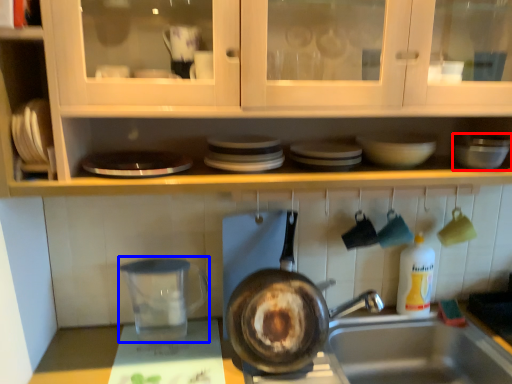
Question: Among these objects, which one is farthest to the camera, mixing bowl (highlighted by a red box) or appliance (highlighted by a blue box)?

Choices:
 (A) mixing bowl
 (B) appliance

Answer: (B)